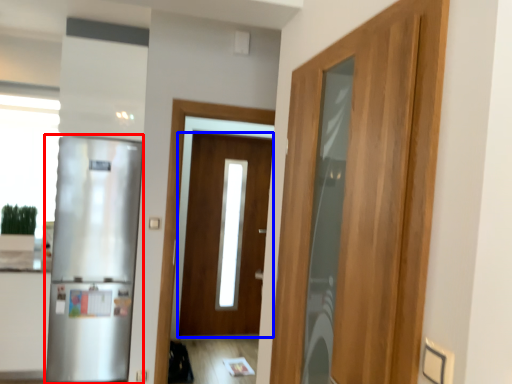
Question: Among these objects, which one is nearest to the camera, refrigerator (highlighted by a red box) or door (highlighted by a blue box)?

Choices:
 (A) refrigerator
 (B) door

Answer: (A)